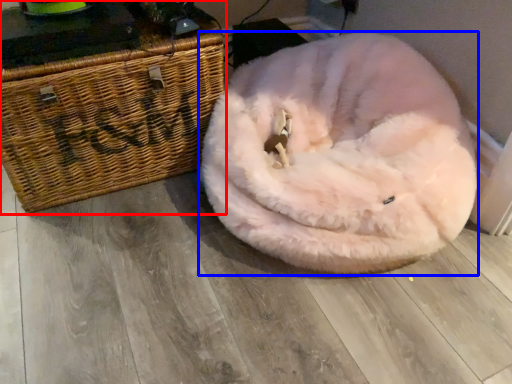
Question: Which point is further to the camera, furniture (highlighted by a red box) or dog bed (highlighted by a blue box)?

Choices:
 (A) furniture
 (B) dog bed

Answer: (A)